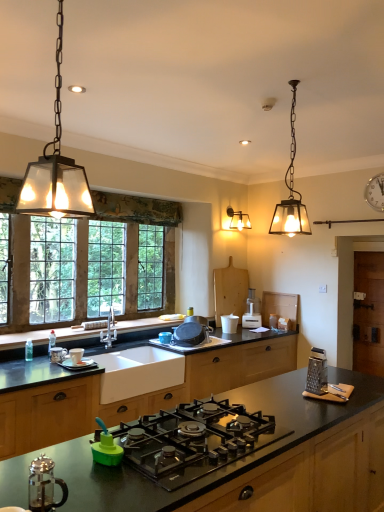
You are a GUI agent. You are given a task and a screenshot of the screen. Output one action in this format:
    pyautogui.click(x=<x>, y=<y>)
    Task: Click on the vacant space to the right of clear glass french press at lower left
    
    Given the screenshot: What is the action you would take?
    pyautogui.click(x=105, y=499)